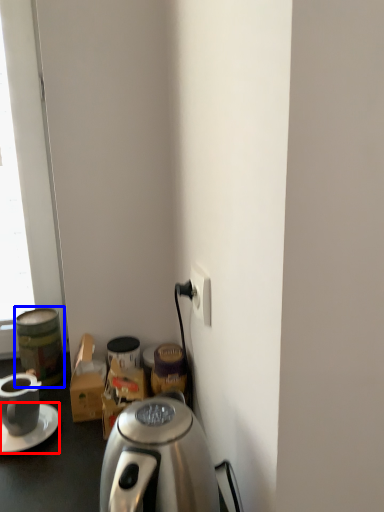
Question: Which point is further to the camera, saucer (highlighted by a red box) or beverage (highlighted by a blue box)?

Choices:
 (A) saucer
 (B) beverage

Answer: (B)